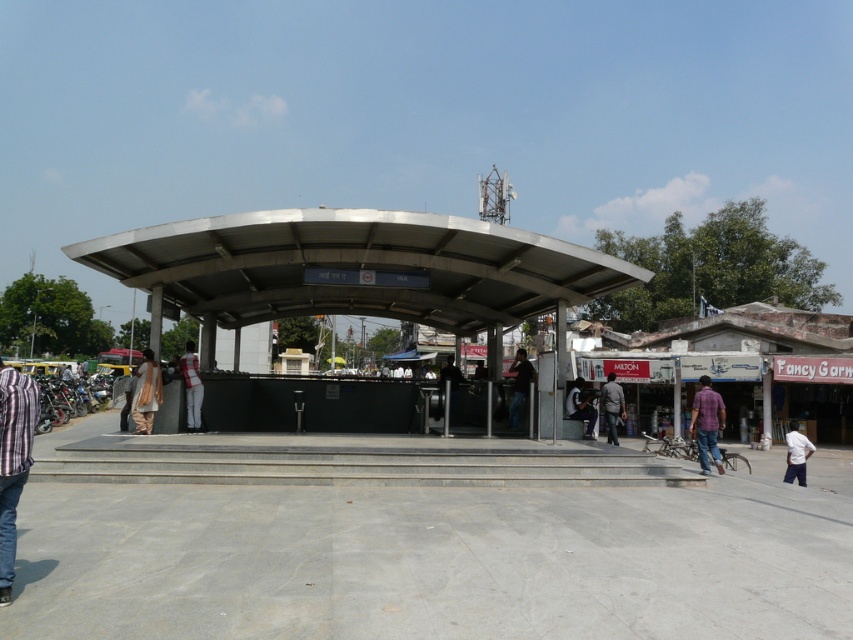
Question: Which point is closer to the camera?

Choices:
 (A) dark brown leather jacket at center
 (B) dark gray shirt at center

Answer: (B)

Question: Does purple cotton shirt at lower right have a smaller size compared to dark brown leather jacket at center?

Choices:
 (A) no
 (B) yes

Answer: (A)

Question: Considering the real-world distances, which object is farthest from the purple cotton shirt at lower right?

Choices:
 (A) light beige fabric at left
 (B) dark brown leather jacket at center

Answer: (A)

Question: Among these objects, which one is farthest from the camera?

Choices:
 (A) dark brown leather jacket at center
 (B) white cotton pants at center
 (C) dark gray shirt at center

Answer: (A)

Question: Is light beige fabric at left to the right of dark blue jeans at center from the viewer's perspective?

Choices:
 (A) no
 (B) yes

Answer: (A)

Question: Is white cotton pants at center thinner than dark gray shirt at center?

Choices:
 (A) yes
 (B) no

Answer: (B)